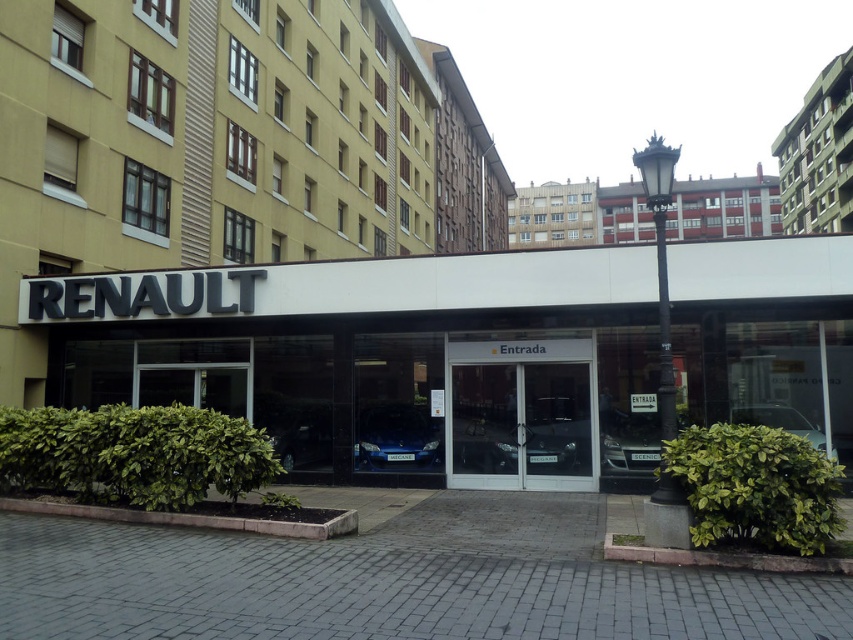
You are a customer looking to enter the Renault dealership. You see the satin blue car at center and the light brown wooden building at upper center. Which object is taller?

The light brown wooden building at upper center is taller than the satin blue car at center.

You are a customer approaching the Renault dealership and see the satin blue car at center and the light brown wooden building at upper center. Which object is nearer to you as you stand at the entrance?

The satin blue car at center is closer to the viewer than the light brown wooden building at upper center, so the satin blue car at center is nearer to you.